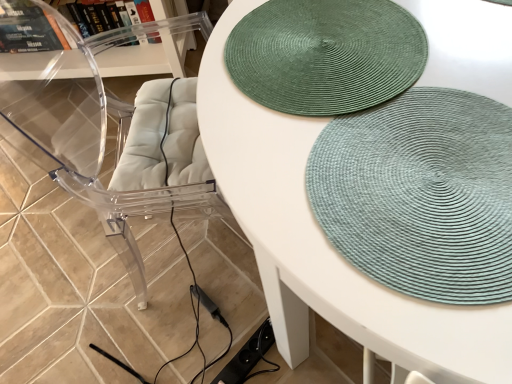
Find the location of a particular element. The width and height of the screenshot is (512, 384). vacant space underneath green woven mat at upper center, which is the first mat from top to bottom (from a real-world perspective) is located at coordinates (342, 48).